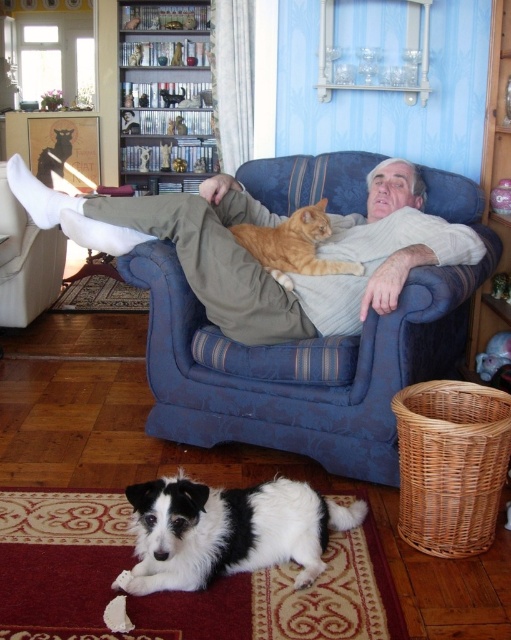
Question: Does white knit sweater at center appear on the right side of black-and-white fur dog at lower center?

Choices:
 (A) no
 (B) yes

Answer: (A)

Question: Among these objects, which one is farthest from the camera?

Choices:
 (A) black-and-white fur dog at lower center
 (B) orange fur cat at center
 (C) blue fabric couch at center
 (D) white knit sweater at center

Answer: (B)

Question: Considering the relative positions of blue fabric couch at center and orange fur cat at center in the image provided, where is blue fabric couch at center located with respect to orange fur cat at center?

Choices:
 (A) right
 (B) left

Answer: (A)

Question: Which point appears farthest from the camera in this image?

Choices:
 (A) (198, 531)
 (B) (403, 260)
 (C) (150, 355)
 (D) (320, 208)

Answer: (D)

Question: Is blue fabric couch at center to the right of orange fur cat at center from the viewer's perspective?

Choices:
 (A) no
 (B) yes

Answer: (B)

Question: Which of these objects is positioned closest to the orange fur cat at center?

Choices:
 (A) blue fabric couch at center
 (B) white knit sweater at center
 (C) black-and-white fur dog at lower center

Answer: (B)